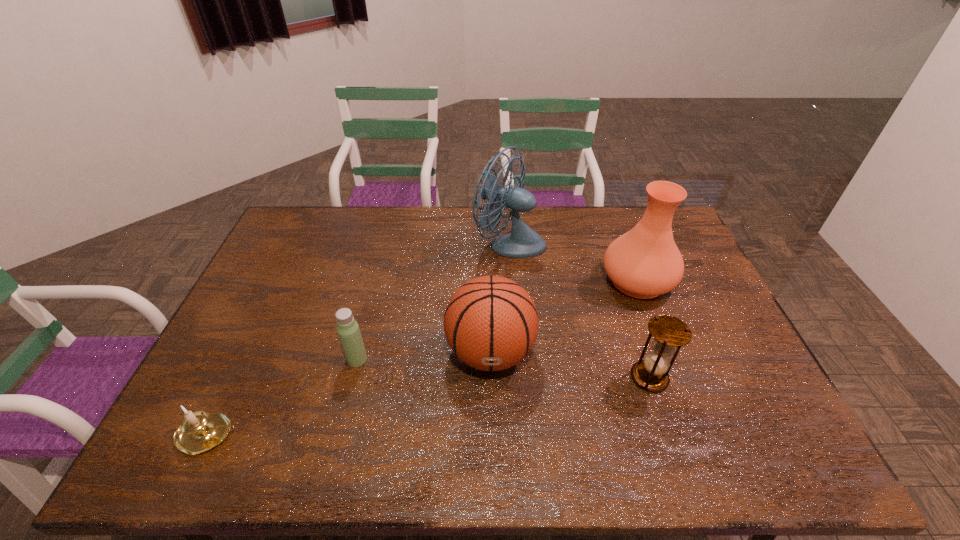
Image resolution: width=960 pixels, height=540 pixels. Identify the location of free region at the far edge of the desktop. (399, 225).

This screenshot has width=960, height=540. In the image, there is a desktop. Identify the location of vacant space at the near edge. (555, 458).

Locate an element on the screen. The image size is (960, 540). vacant point at the left edge is located at coordinates (291, 279).

In order to click on free region at the right edge of the desktop in this screenshot , I will do `click(690, 314)`.

Find the location of a particular element. This screenshot has height=540, width=960. vacant region at the far left corner of the desktop is located at coordinates (324, 230).

Image resolution: width=960 pixels, height=540 pixels. Find the location of `free space at the far right corner`. free space at the far right corner is located at coordinates (632, 215).

The height and width of the screenshot is (540, 960). Find the location of `vacant space at the near right corner`. vacant space at the near right corner is located at coordinates (778, 461).

At what (x,y) coordinates should I click in order to perform the action: click on free space that is in between the fan and the hourglass. Please return your answer as a coordinate pair (x, y). Looking at the image, I should click on (580, 310).

Locate an element on the screen. free space between the nearest object and the hourglass is located at coordinates tap(429, 406).

Identify the location of free point between the shortest object and the hourglass. (429, 406).